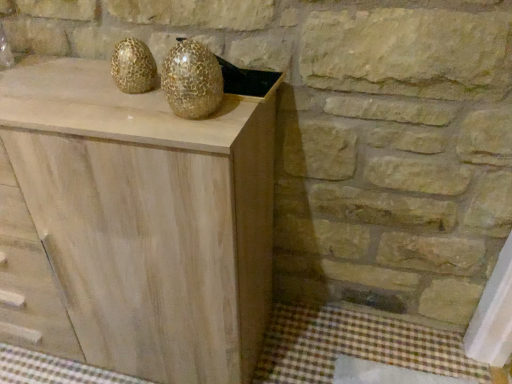
This screenshot has height=384, width=512. What do you see at coordinates (146, 220) in the screenshot? I see `natural wood cabinet at center` at bounding box center [146, 220].

You are a GUI agent. You are given a task and a screenshot of the screen. Output one action in this format:
    pyautogui.click(x=<x>, y=<y>)
    Task: Click on the natural wood cabinet at center
    This screenshot has width=512, height=384.
    Given the screenshot: What is the action you would take?
    pyautogui.click(x=146, y=220)

What is the approximate width of natural wood cabinet at center?

41.70 centimeters.

Measure the distance between gold textured vase at center and camera.

gold textured vase at center is 29.61 inches from camera.

You are a GUI agent. You are given a task and a screenshot of the screen. Output one action in this format:
    pyautogui.click(x=<x>, y=<y>)
    Task: Click on the gold textured vase at center
    
    Given the screenshot: What is the action you would take?
    (x=192, y=80)

What do you see at coordinates (192, 80) in the screenshot?
I see `gold textured vase at center` at bounding box center [192, 80].

Locate an element on the screen. Image resolution: width=512 pixels, height=384 pixels. natural wood cabinet at center is located at coordinates (146, 220).

Considering the positions of objects gold textured vase at center and natural wood cabinet at center in the image provided, who is more to the right, gold textured vase at center or natural wood cabinet at center?

From the viewer's perspective, gold textured vase at center appears more on the right side.

Is the depth of gold textured vase at center greater than that of natural wood cabinet at center?

Yes, it is behind natural wood cabinet at center.

Is point (203, 93) positioned after point (116, 295)?

No, (203, 93) is in front of (116, 295).

From the image's perspective, which object appears higher, gold textured vase at center or natural wood cabinet at center?

gold textured vase at center appears higher in the image.

From a real-world perspective, is gold textured vase at center physically located above or below natural wood cabinet at center?

Clearly, from a real-world perspective, gold textured vase at center is above natural wood cabinet at center.

Which of these two, gold textured vase at center or natural wood cabinet at center, is wider?

natural wood cabinet at center is wider.

Does gold textured vase at center have a lesser height compared to natural wood cabinet at center?

Indeed, gold textured vase at center has a lesser height compared to natural wood cabinet at center.

Between gold textured vase at center and natural wood cabinet at center, which one has smaller size?

gold textured vase at center is smaller.

Is gold textured vase at center outside of natural wood cabinet at center?

Absolutely, gold textured vase at center is external to natural wood cabinet at center.

Is gold textured vase at center placed right next to natural wood cabinet at center?

No, gold textured vase at center is not making contact with natural wood cabinet at center.

Is gold textured vase at center oriented towards natural wood cabinet at center?

No, gold textured vase at center is not oriented towards natural wood cabinet at center.

How different are the orientations of gold textured vase at center and natural wood cabinet at center in degrees?

gold textured vase at center and natural wood cabinet at center are facing 4.62 degrees away from each other.

Find the location of `glass vase behind the natural wood cabinet at center`. glass vase behind the natural wood cabinet at center is located at coordinates (192, 80).

Which is more to the left, natural wood cabinet at center or gold textured vase at center?

Positioned to the left is natural wood cabinet at center.

In the image, is natural wood cabinet at center positioned in front of or behind gold textured vase at center?

natural wood cabinet at center is positioned closer to the viewer than gold textured vase at center.

Does point (50, 235) appear closer or farther from the camera than point (220, 88)?

Point (50, 235) is farther from the camera than point (220, 88).

From the image's perspective, which one is positioned lower, natural wood cabinet at center or gold textured vase at center?

From the image's view, natural wood cabinet at center is below.

From a real-world perspective, between natural wood cabinet at center and gold textured vase at center, who is vertically higher?

gold textured vase at center is physically above.

Considering the sizes of objects natural wood cabinet at center and gold textured vase at center in the image provided, who is thinner, natural wood cabinet at center or gold textured vase at center?

Thinner between the two is gold textured vase at center.

Between natural wood cabinet at center and gold textured vase at center, which one has less height?

With less height is gold textured vase at center.

In terms of size, does natural wood cabinet at center appear bigger or smaller than gold textured vase at center?

Considering their sizes, natural wood cabinet at center takes up more space than gold textured vase at center.

Is natural wood cabinet at center not within gold textured vase at center?

Absolutely, natural wood cabinet at center is external to gold textured vase at center.

Is there a large distance between natural wood cabinet at center and gold textured vase at center?

natural wood cabinet at center is actually quite close to gold textured vase at center.

Is natural wood cabinet at center oriented towards gold textured vase at center?

No, natural wood cabinet at center does not turn towards gold textured vase at center.

In the image, there is a gold textured vase at center. Where is `the chest of drawers below it (from the image's perspective)`? the chest of drawers below it (from the image's perspective) is located at coordinates (146, 220).

Locate an element on the screen. chest of drawers lying on the left of gold textured vase at center is located at coordinates (146, 220).

Find the location of a particular element. This screenshot has height=384, width=512. chest of drawers below the gold textured vase at center (from the image's perspective) is located at coordinates (146, 220).